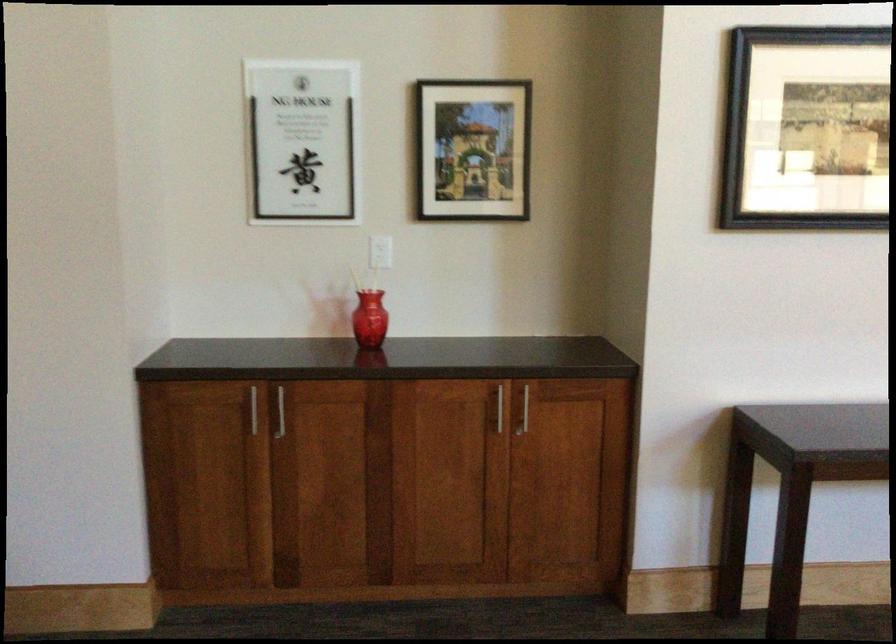
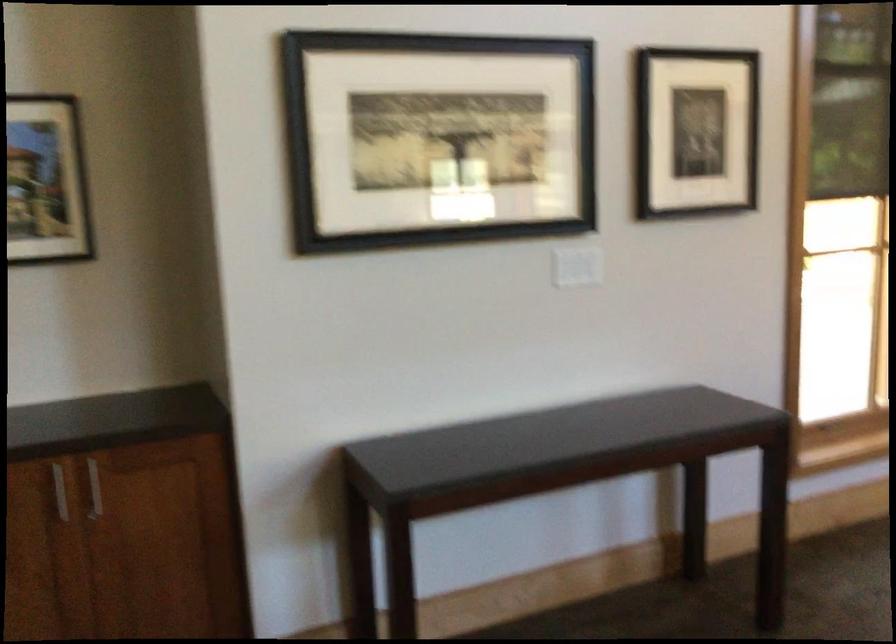
Question: How did the camera likely rotate?

Choices:
 (A) Left
 (B) Right
 (C) Up
 (D) Down

Answer: (B)